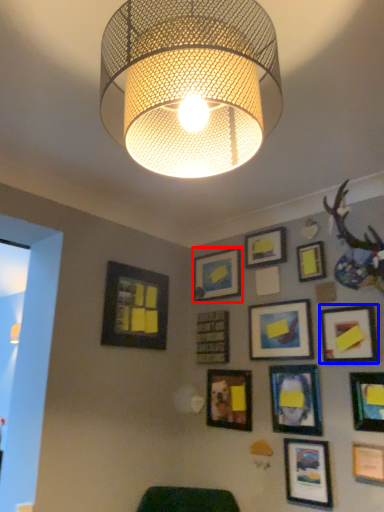
Question: Which object appears closest to the camera in this image, picture frame (highlighted by a red box) or picture frame (highlighted by a blue box)?

Choices:
 (A) picture frame
 (B) picture frame

Answer: (B)